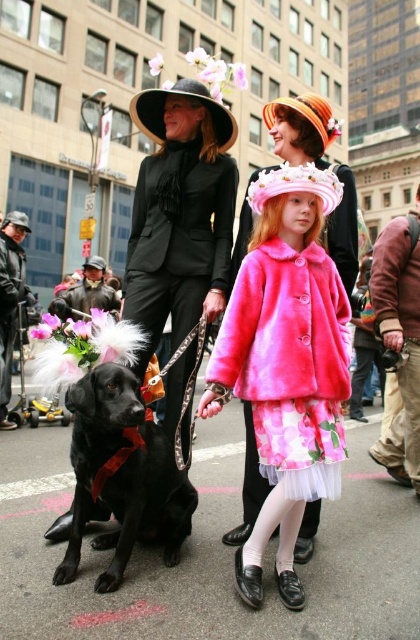
Can you confirm if brown leather jacket at right is positioned to the left of black leather jacket at left?

Incorrect, brown leather jacket at right is not on the left side of black leather jacket at left.

Is point (411, 380) behind point (4, 406)?

No, (411, 380) is in front of (4, 406).

This screenshot has height=640, width=420. I want to click on brown leather jacket at right, so click(x=399, y=339).

Can you confirm if pink fuzzy coat at center is shorter than shiny black dog at center?

Yes.

Does pink fuzzy coat at center have a greater height compared to shiny black dog at center?

Incorrect, pink fuzzy coat at center's height is not larger of shiny black dog at center's.

I want to click on pink fuzzy coat at center, so click(286, 364).

Where is `pink fuzzy coat at center`? pink fuzzy coat at center is located at coordinates (286, 364).

Is the position of black leather jacket at left more distant than that of leather jacket at center?

No.

Can you confirm if black leather jacket at left is positioned below leather jacket at center?

Indeed, black leather jacket at left is positioned under leather jacket at center.

Locate an element on the screen. The image size is (420, 640). black leather jacket at left is located at coordinates (10, 300).

The width and height of the screenshot is (420, 640). In order to click on black leather jacket at left in this screenshot , I will do `click(10, 300)`.